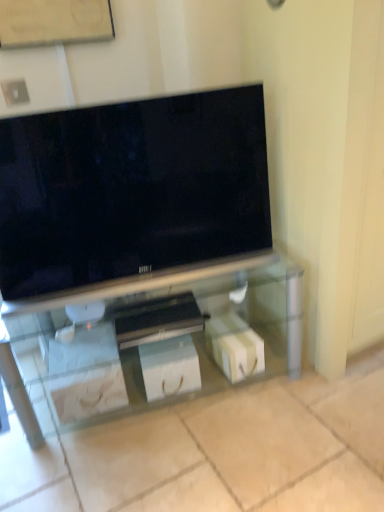
Question: Considering the positions of white glossy box at center, the first box in the right-to-left sequence, and matte black tv at center in the image, is white glossy box at center, the first box in the right-to-left sequence, wider or thinner than matte black tv at center?

Choices:
 (A) wide
 (B) thin

Answer: (A)

Question: Choose the correct answer: Is white glossy box at center, the first box in the right-to-left sequence, inside matte black tv at center or outside it?

Choices:
 (A) inside
 (B) outside

Answer: (B)

Question: Based on their relative distances, which object is nearer to the clear glass tv stand at center?

Choices:
 (A) white paper bag at lower center, arranged as the 2th box when viewed from the right
 (B) wooden bulletin board at upper center
 (C) matte black tv at center
 (D) white glossy box at center, the first box in the right-to-left sequence

Answer: (A)

Question: Estimate the real-world distances between objects in this image. Which object is farther from the white paper bag at lower center, arranged as the 2th box when viewed from the right?

Choices:
 (A) matte black tv at center
 (B) white glossy box at center, the first box in the right-to-left sequence
 (C) wooden bulletin board at upper center
 (D) clear glass tv stand at center

Answer: (C)